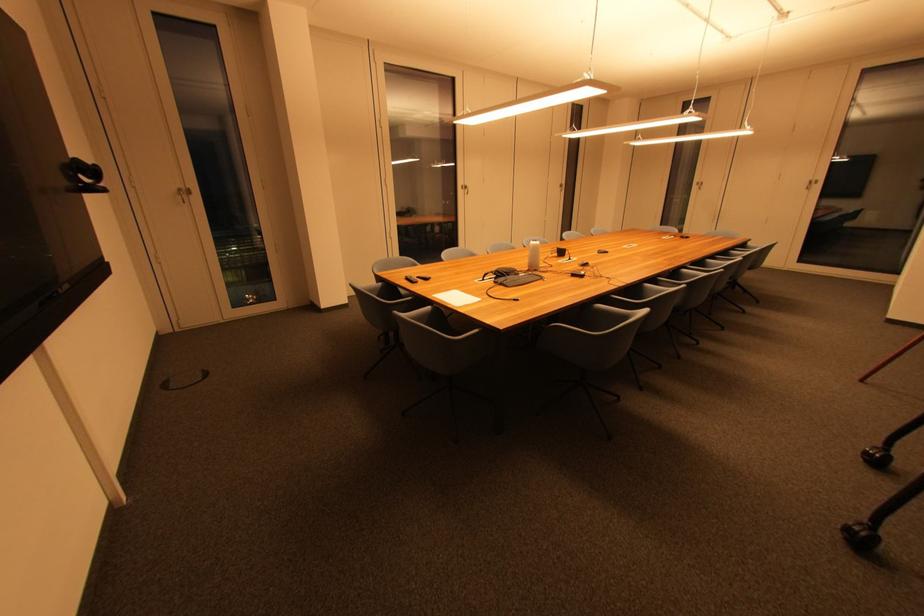
What do you see at coordinates (464, 188) in the screenshot? Image resolution: width=924 pixels, height=616 pixels. I see `the silver cabinet handle` at bounding box center [464, 188].